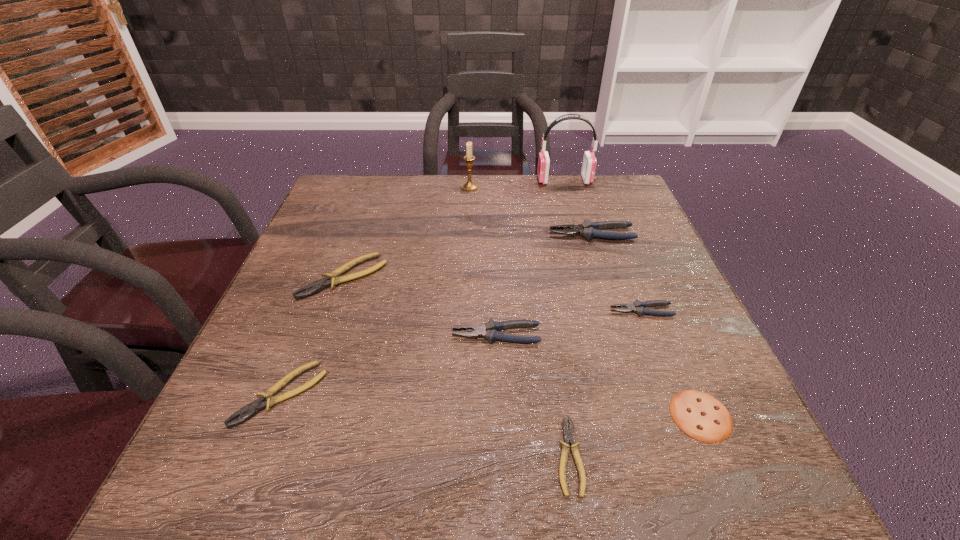
The image size is (960, 540). Find the location of `vacant area located 0.350m at the gripping part of the farthest gray pliers`. vacant area located 0.350m at the gripping part of the farthest gray pliers is located at coordinates (409, 234).

Locate an element on the screen. The width and height of the screenshot is (960, 540). vacant space located 0.230m at the gripping part of the farthest gray pliers is located at coordinates (458, 234).

I want to click on blank area located at the gripping part of the leftmost gray pliers, so click(x=365, y=335).

The width and height of the screenshot is (960, 540). In order to click on vacant space situated 0.270m at the gripping part of the leftmost gray pliers in this screenshot , I will do `click(312, 335)`.

This screenshot has height=540, width=960. I want to click on vacant space located 0.260m at the gripping part of the leftmost gray pliers, so click(318, 335).

The width and height of the screenshot is (960, 540). What are the coordinates of `blank area located on the front of the fifth nearest pliers` in the screenshot? It's located at (268, 491).

Locate an element on the screen. The height and width of the screenshot is (540, 960). vacant space located at the gripping part of the fifth farthest object is located at coordinates (547, 310).

I want to click on vacant space positioned at the gripping part of the fifth farthest object, so click(x=557, y=310).

The image size is (960, 540). What are the coordinates of `vacant space located at the gripping part of the fifth farthest object` in the screenshot? It's located at 576,310.

The image size is (960, 540). Find the location of `vacant space located 0.250m on the right of the fifth tallest pliers`. vacant space located 0.250m on the right of the fifth tallest pliers is located at coordinates (468, 394).